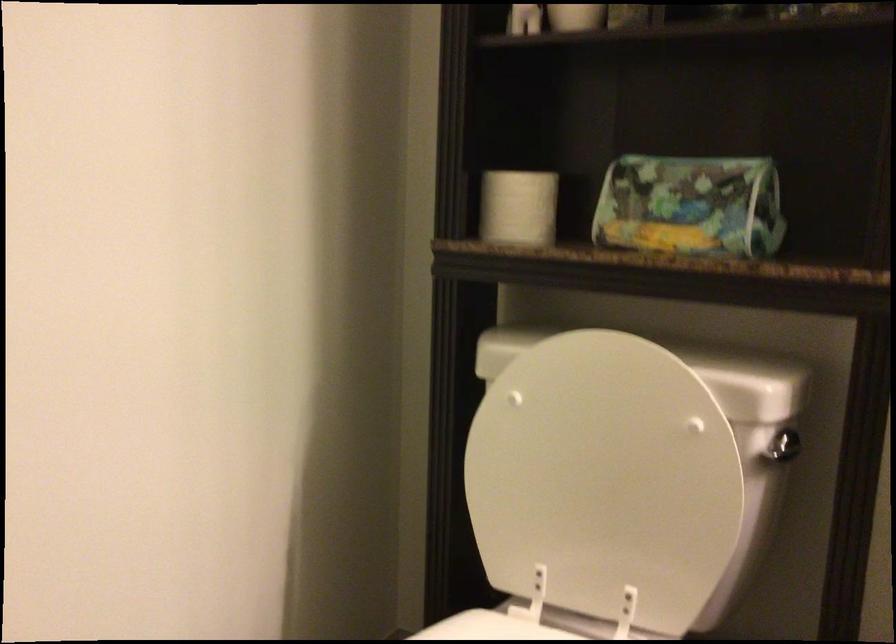
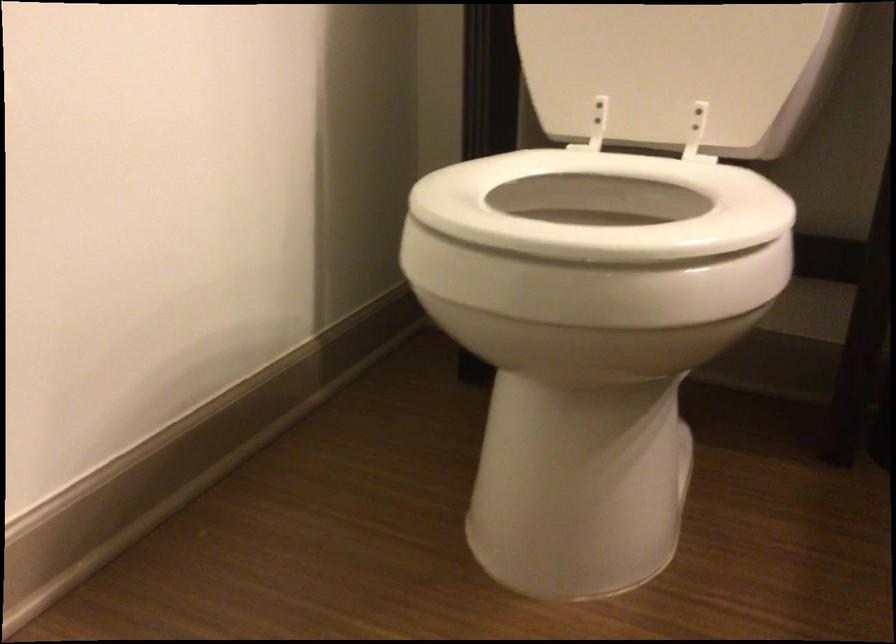
The point at (615, 554) is marked in the first image. Where is the corresponding point in the second image?

(677, 71)